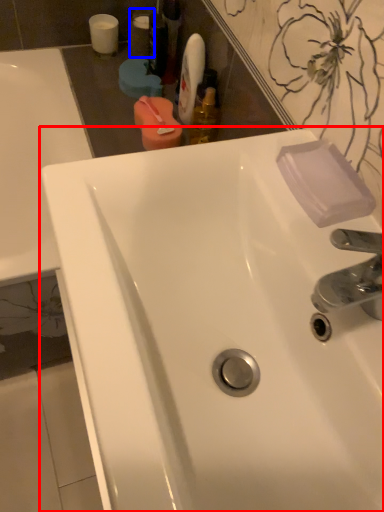
Question: Among these objects, which one is farthest to the camera, sink (highlighted by a red box) or mouthwash (highlighted by a blue box)?

Choices:
 (A) sink
 (B) mouthwash

Answer: (B)